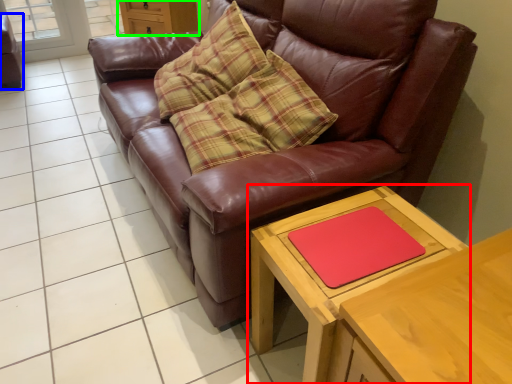
Question: Which object is the farthest from table (highlighted by a red box)? Choose among these: swivel chair (highlighted by a blue box) or dresser (highlighted by a green box).

Choices:
 (A) swivel chair
 (B) dresser

Answer: (A)